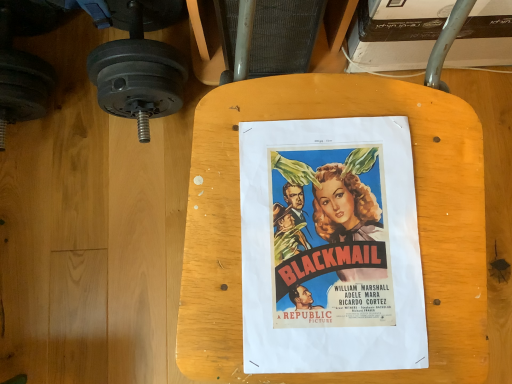
This screenshot has height=384, width=512. What are the coordinates of `vacant space to the left of wooden table at center` in the screenshot? It's located at (115, 247).